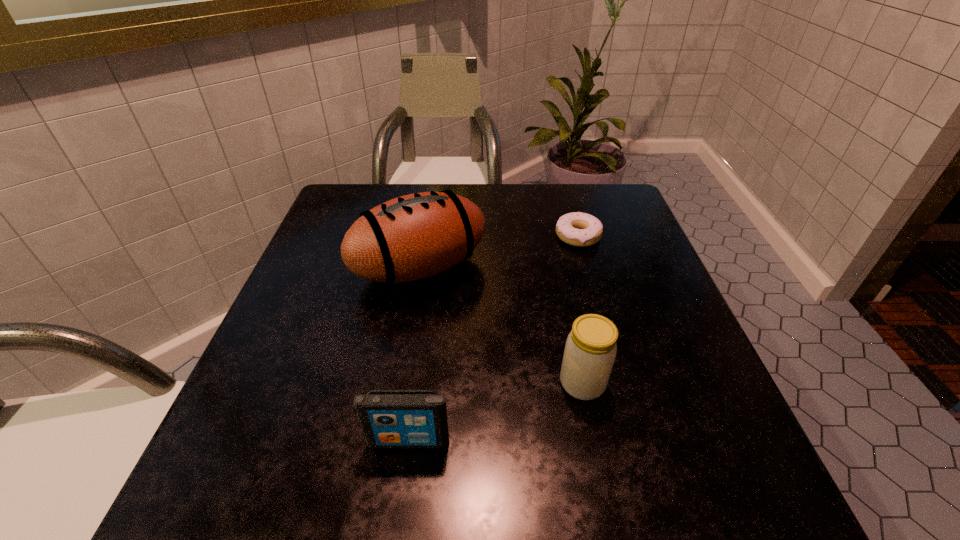
At what (x,y) coordinates should I click in order to perform the action: click on unoccupied position between the third tallest object and the jar. Please return your answer as a coordinate pair (x, y). Looking at the image, I should click on (495, 412).

Identify the location of vacant area that lies between the tallest object and the shortest object. Image resolution: width=960 pixels, height=540 pixels. (499, 252).

Image resolution: width=960 pixels, height=540 pixels. I want to click on blank region between the jar and the iPod, so click(x=495, y=412).

You are a GUI agent. You are given a task and a screenshot of the screen. Output one action in this format:
    pyautogui.click(x=<x>, y=<y>)
    Task: Click on the vacant space that's between the shortest object and the tallest object
    Image resolution: width=960 pixels, height=540 pixels.
    Given the screenshot: What is the action you would take?
    [499, 252]

Identify the location of vacant space in between the doughnut and the jar. (580, 310).

Identify the location of vacant area between the shortest object and the nearest object. (493, 339).

Where is `free point between the shortest object and the tallest object`? free point between the shortest object and the tallest object is located at coordinates point(499,252).

The height and width of the screenshot is (540, 960). What are the coordinates of `vacant space that is in between the third tallest object and the football (American)` in the screenshot? It's located at (414, 354).

At what (x,y) coordinates should I click in order to perform the action: click on vacant region between the jar and the third tallest object. Please return your answer as a coordinate pair (x, y). The width and height of the screenshot is (960, 540). Looking at the image, I should click on (495, 412).

Where is `vacant area between the football (American) and the second shortest object`? vacant area between the football (American) and the second shortest object is located at coordinates (414, 354).